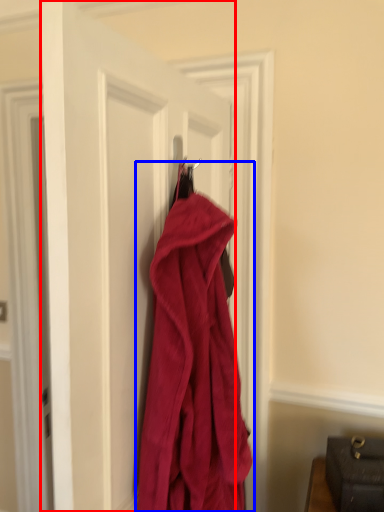
Question: Among these objects, which one is farthest to the camera, door (highlighted by a red box) or towel (highlighted by a blue box)?

Choices:
 (A) door
 (B) towel

Answer: (B)